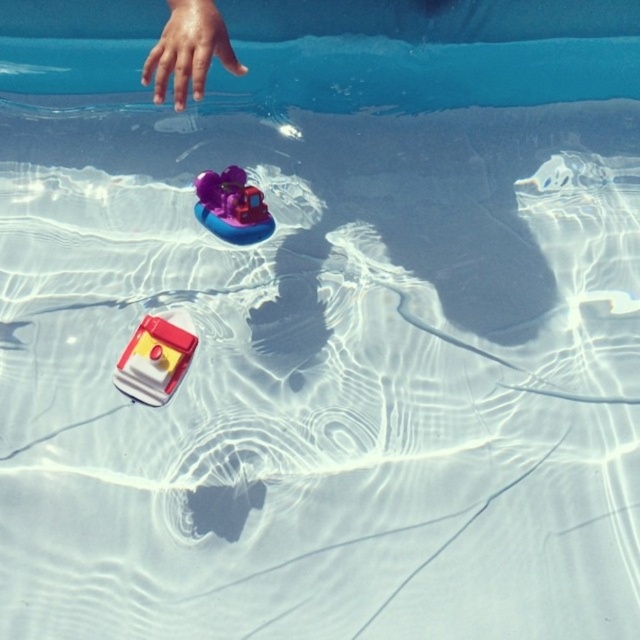
You are a photographer trying to capture the two points in the image. Which point, point [144,388] or point [260,212], will appear larger in your photo?

Point [144,388] is closer to the camera than point [260,212], so it will appear larger in the photo.

You are a parent supervising a child playing near the pool. You notice the smooth skin hand at upper left and the matte red boat at lower left. Can you safely place a 24 inch ruler between them without touching either object?

The smooth skin hand at upper left and the matte red boat at lower left are 22.58 inches apart from each other. Since the ruler is 24 inches long, it would extend beyond the space between them, so placing it without touching either object is not possible.